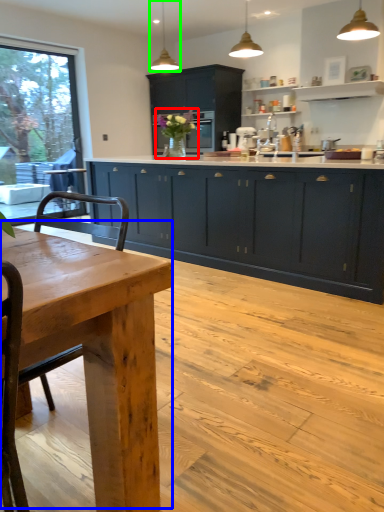
Question: Which object is positioned closest to floral arrangement (highlighted by a red box)? Select from kitchen & dining room table (highlighted by a blue box) and light fixture (highlighted by a green box).

Choices:
 (A) kitchen & dining room table
 (B) light fixture

Answer: (B)